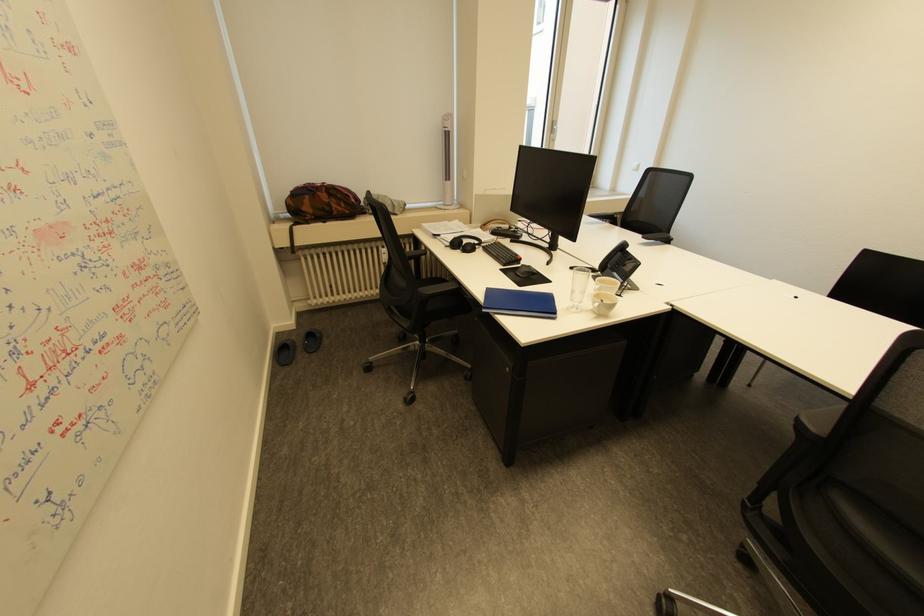
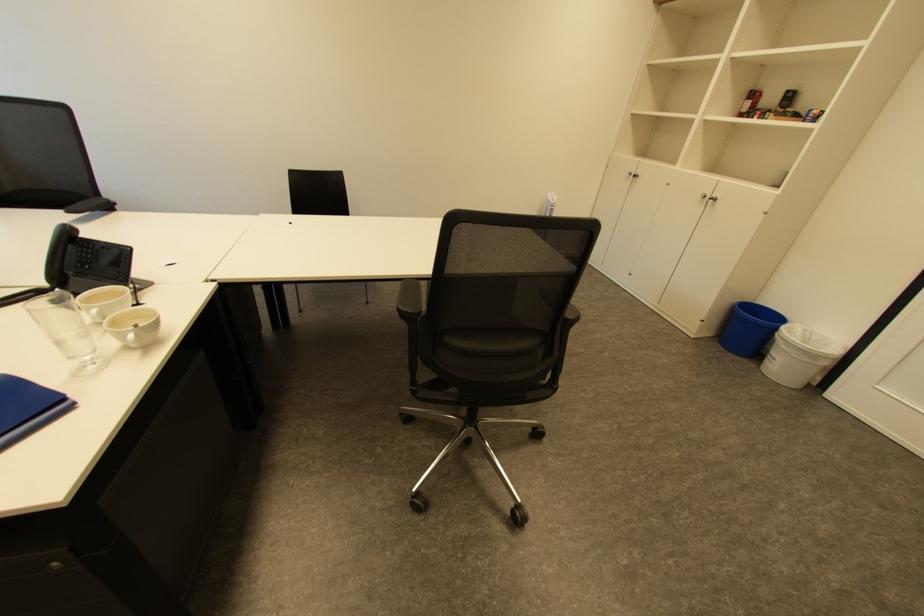
Where in the second image is the point corresponding to the point at 600,310 from the first image?

(131, 347)